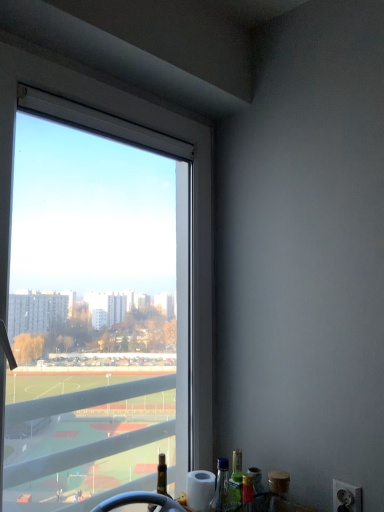
Question: Does white plastic power outlet at lower right have a smaller size compared to transparent glass window at upper left?

Choices:
 (A) yes
 (B) no

Answer: (A)

Question: Are white plastic power outlet at lower right and transparent glass window at upper left making contact?

Choices:
 (A) no
 (B) yes

Answer: (A)

Question: Is white plastic power outlet at lower right closer to camera compared to transparent glass window at upper left?

Choices:
 (A) yes
 (B) no

Answer: (B)

Question: Can we say white plastic power outlet at lower right lies outside transparent glass window at upper left?

Choices:
 (A) yes
 (B) no

Answer: (A)

Question: Does white plastic power outlet at lower right have a lesser height compared to transparent glass window at upper left?

Choices:
 (A) no
 (B) yes

Answer: (B)

Question: From a real-world perspective, is transparent glass window at upper left positioned above or below green glass bottle at lower right?

Choices:
 (A) below
 (B) above

Answer: (B)

Question: From the image's perspective, is transparent glass window at upper left above or below green glass bottle at lower right?

Choices:
 (A) below
 (B) above

Answer: (B)

Question: Relative to green glass bottle at lower right, is transparent glass window at upper left in front or behind?

Choices:
 (A) behind
 (B) front

Answer: (B)

Question: Does point (206, 329) appear closer or farther from the camera than point (235, 500)?

Choices:
 (A) farther
 (B) closer

Answer: (A)

Question: Is point (231, 465) closer or farther from the camera than point (344, 487)?

Choices:
 (A) farther
 (B) closer

Answer: (A)

Question: From the image's perspective, is green glass bottle at lower right located above or below white plastic power outlet at lower right?

Choices:
 (A) below
 (B) above

Answer: (A)

Question: Considering the relative positions of green glass bottle at lower right and white plastic power outlet at lower right in the image provided, is green glass bottle at lower right to the left or to the right of white plastic power outlet at lower right?

Choices:
 (A) right
 (B) left

Answer: (B)

Question: From their relative heights in the image, would you say green glass bottle at lower right is taller or shorter than white plastic power outlet at lower right?

Choices:
 (A) tall
 (B) short

Answer: (A)

Question: Considering the positions of transparent glass window at upper left and white plastic power outlet at lower right in the image, is transparent glass window at upper left taller or shorter than white plastic power outlet at lower right?

Choices:
 (A) tall
 (B) short

Answer: (A)

Question: Considering the positions of transparent glass window at upper left and white plastic power outlet at lower right in the image, is transparent glass window at upper left wider or thinner than white plastic power outlet at lower right?

Choices:
 (A) thin
 (B) wide

Answer: (B)